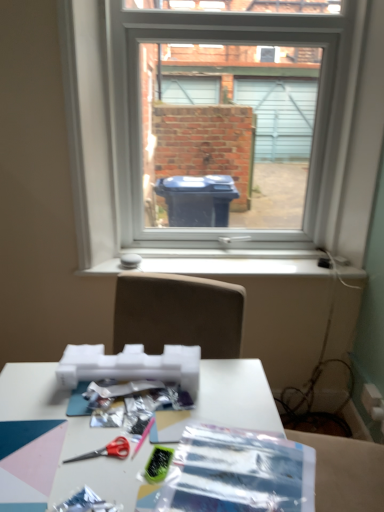
The width and height of the screenshot is (384, 512). Identify the location of vacant space positioned to the left of red plastic scissors at lower center. (34, 446).